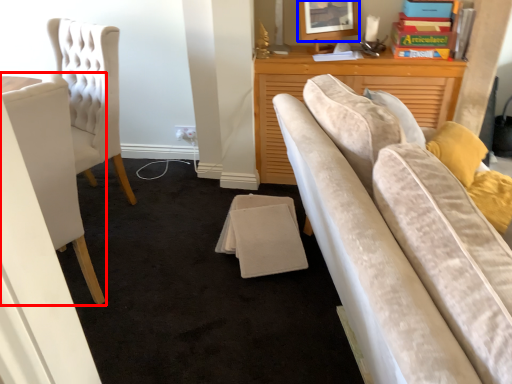
Question: Which object is further to the camera taking this photo, chair (highlighted by a red box) or picture frame (highlighted by a blue box)?

Choices:
 (A) chair
 (B) picture frame

Answer: (B)